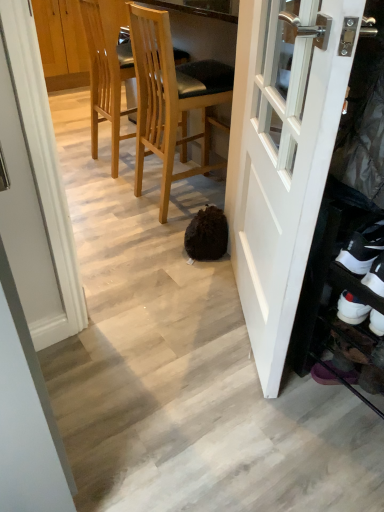
Question: Is white suede shoe at lower right, acting as the 2th shoe starting from the front, positioned with its back to light brown wood chair at center, which ranks as the 2th chair in right-to-left order?

Choices:
 (A) yes
 (B) no

Answer: (B)

Question: Are white suede shoe at lower right, placed as the first shoe when sorted from back to front, and light brown wood chair at center, which ranks as the 2th chair in right-to-left order, far apart?

Choices:
 (A) yes
 (B) no

Answer: (A)

Question: Can you confirm if white suede shoe at lower right, placed as the first shoe when sorted from back to front, is taller than light brown wood chair at center, the 1th chair in the left-to-right sequence?

Choices:
 (A) no
 (B) yes

Answer: (A)

Question: Does white suede shoe at lower right, placed as the first shoe when sorted from back to front, have a lesser height compared to light brown wood chair at center, the 1th chair in the left-to-right sequence?

Choices:
 (A) no
 (B) yes

Answer: (B)

Question: Is white suede shoe at lower right, acting as the 2th shoe starting from the front, to the right of light brown wood chair at center, the 1th chair in the left-to-right sequence, from the viewer's perspective?

Choices:
 (A) yes
 (B) no

Answer: (A)

Question: From a real-world perspective, is light brown wood chair at center, which ranks as the 2th chair in right-to-left order, positioned above or below light brown wood chair at center, which is counted as the 1th chair, starting from the right?

Choices:
 (A) below
 (B) above

Answer: (A)

Question: Looking at the image, does light brown wood chair at center, which ranks as the 2th chair in right-to-left order, seem bigger or smaller compared to light brown wood chair at center, acting as the second chair starting from the left?

Choices:
 (A) small
 (B) big

Answer: (A)

Question: Is point (107, 117) positioned closer to the camera than point (162, 172)?

Choices:
 (A) farther
 (B) closer

Answer: (A)

Question: Is light brown wood chair at center, the 1th chair in the left-to-right sequence, spatially inside light brown wood chair at center, acting as the second chair starting from the left, or outside of it?

Choices:
 (A) inside
 (B) outside

Answer: (B)

Question: Based on their positions, is white suede shoe at lower right, placed as the first shoe when sorted from back to front, located to the left or right of light brown wood chair at center, acting as the second chair starting from the left?

Choices:
 (A) right
 (B) left

Answer: (A)

Question: Is white suede shoe at lower right, acting as the 2th shoe starting from the front, situated inside light brown wood chair at center, which is counted as the 1th chair, starting from the right, or outside?

Choices:
 (A) outside
 (B) inside

Answer: (A)

Question: In terms of height, does white suede shoe at lower right, acting as the 2th shoe starting from the front, look taller or shorter compared to light brown wood chair at center, acting as the second chair starting from the left?

Choices:
 (A) short
 (B) tall

Answer: (A)

Question: From a real-world perspective, is white suede shoe at lower right, placed as the first shoe when sorted from back to front, above or below light brown wood chair at center, acting as the second chair starting from the left?

Choices:
 (A) below
 (B) above

Answer: (A)

Question: Is point (337, 253) closer or farther from the camera than point (117, 61)?

Choices:
 (A) closer
 (B) farther

Answer: (A)

Question: Based on their sizes in the image, would you say white suede shoe at lower right, marked as the second shoe in a back-to-front arrangement, is bigger or smaller than light brown wood chair at center, the 1th chair in the left-to-right sequence?

Choices:
 (A) big
 (B) small

Answer: (B)